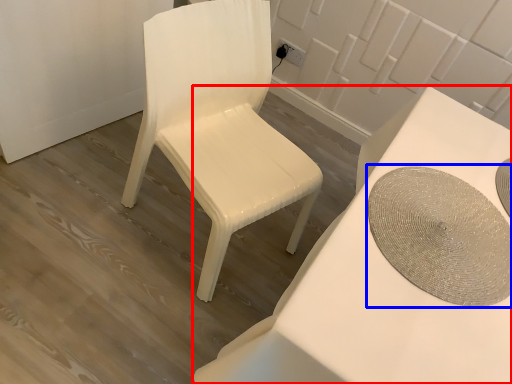
Question: Which object appears farthest to the camera in this image, table (highlighted by a red box) or round table (highlighted by a blue box)?

Choices:
 (A) table
 (B) round table

Answer: (B)